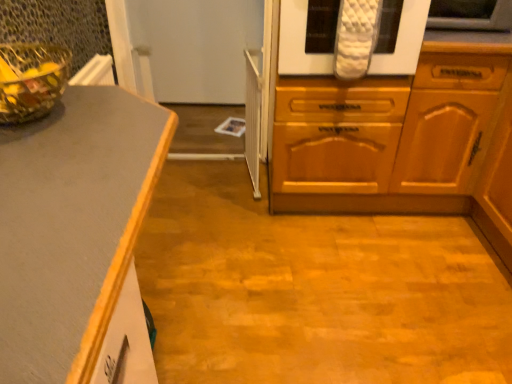
The width and height of the screenshot is (512, 384). In order to click on free space that is to the left of wooden cabinet at center in this screenshot , I will do (x=202, y=203).